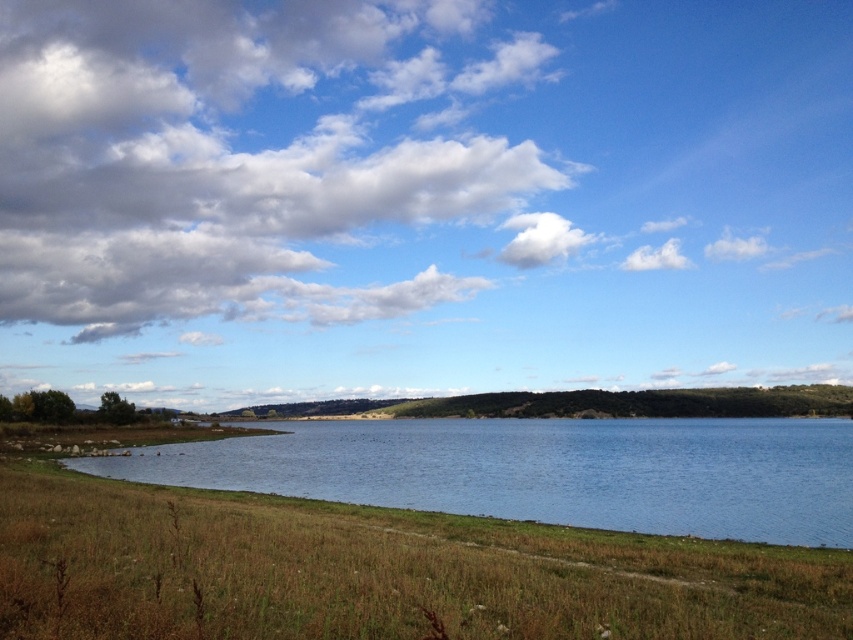
Is dry grass at lower center taller than blue water at center?

No.

Can you confirm if dry grass at lower center is wider than blue water at center?

No, dry grass at lower center is not wider than blue water at center.

At what (x,y) coordinates should I click in order to perform the action: click on dry grass at lower center. Please return your answer as a coordinate pair (x, y). Image resolution: width=853 pixels, height=640 pixels. Looking at the image, I should click on (375, 572).

Locate an element on the screen. The image size is (853, 640). dry grass at lower center is located at coordinates (375, 572).

Who is positioned more to the right, blue water at center or white fluffy cloud at upper center?

white fluffy cloud at upper center

Which of these two, blue water at center or white fluffy cloud at upper center, stands shorter?

With less height is blue water at center.

The height and width of the screenshot is (640, 853). I want to click on blue water at center, so click(x=543, y=470).

Measure the distance between dry grass at lower center and white fluffy cloud at upper center.

A distance of 409.92 meters exists between dry grass at lower center and white fluffy cloud at upper center.

Does dry grass at lower center have a lesser height compared to white fluffy cloud at upper center?

Indeed, dry grass at lower center has a lesser height compared to white fluffy cloud at upper center.

This screenshot has height=640, width=853. Describe the element at coordinates (375, 572) in the screenshot. I see `dry grass at lower center` at that location.

Find the location of `dry grass at lower center`. dry grass at lower center is located at coordinates (375, 572).